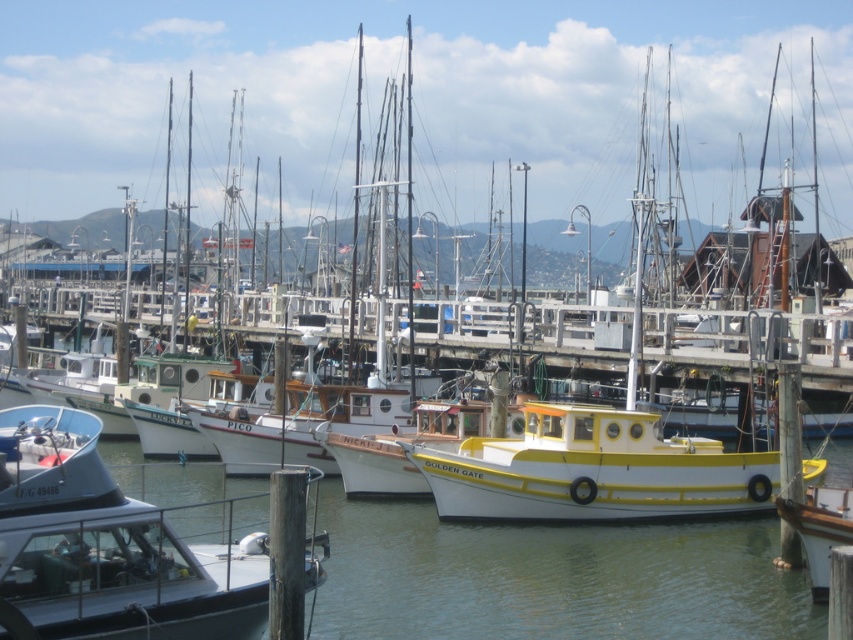
Consider the image. Does matte white boat at lower left have a lesser height compared to yellow matte boat at center?

In fact, matte white boat at lower left may be taller than yellow matte boat at center.

Does matte white boat at lower left have a greater height compared to yellow matte boat at center?

Correct, matte white boat at lower left is much taller as yellow matte boat at center.

Does point (241, 600) come closer to viewer compared to point (657, 477)?

That is True.

At what (x,y) coordinates should I click in order to perform the action: click on matte white boat at lower left. Please return your answer as a coordinate pair (x, y). Looking at the image, I should click on (107, 547).